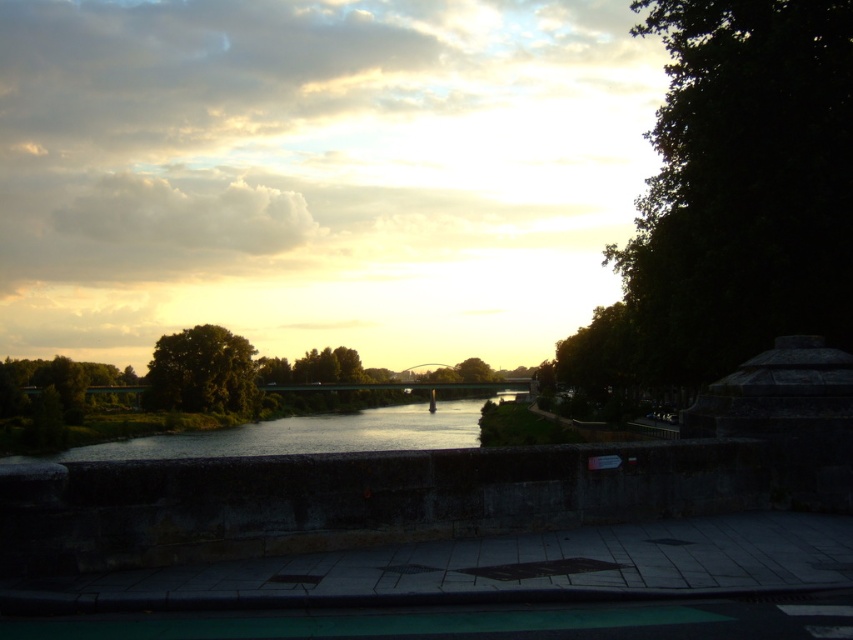
Question: Estimate the real-world distances between objects in this image. Which object is closer to the silvery reflective water at center?

Choices:
 (A) dark green leafy tree at right
 (B) green leafy tree at center

Answer: (B)

Question: Can you confirm if dark green leafy tree at right is thinner than green leafy tree at center?

Choices:
 (A) yes
 (B) no

Answer: (B)

Question: Which object is closer to the camera taking this photo?

Choices:
 (A) dark green leafy tree at right
 (B) silvery reflective water at center
 (C) green leafy tree at center

Answer: (A)

Question: From the image, what is the correct spatial relationship of dark green leafy tree at right in relation to silvery reflective water at center?

Choices:
 (A) below
 (B) above

Answer: (B)

Question: Which point is farther to the camera?

Choices:
 (A) dark green leafy tree at right
 (B) silvery reflective water at center
 (C) green leafy tree at center

Answer: (C)

Question: Does dark green leafy tree at right have a greater width compared to green leafy tree at center?

Choices:
 (A) no
 (B) yes

Answer: (B)